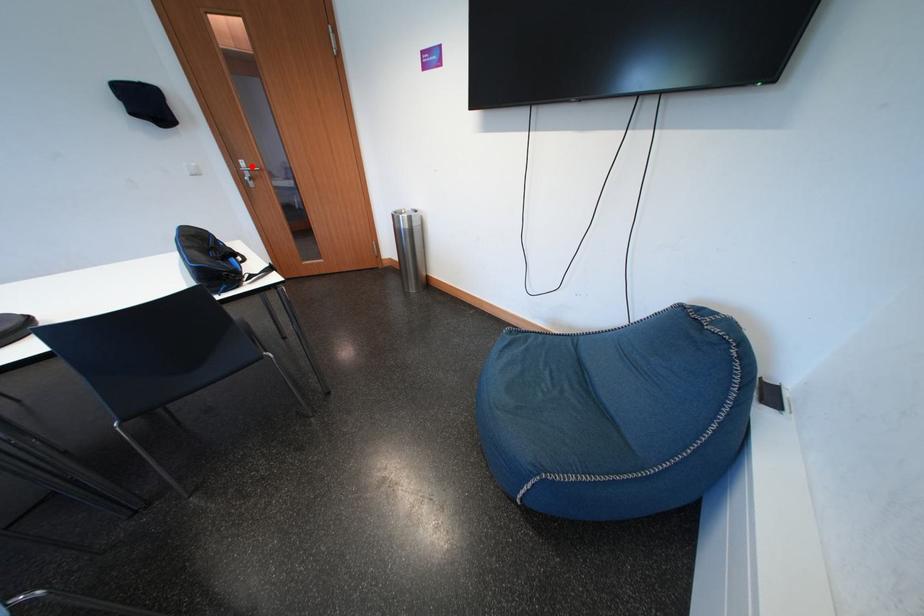
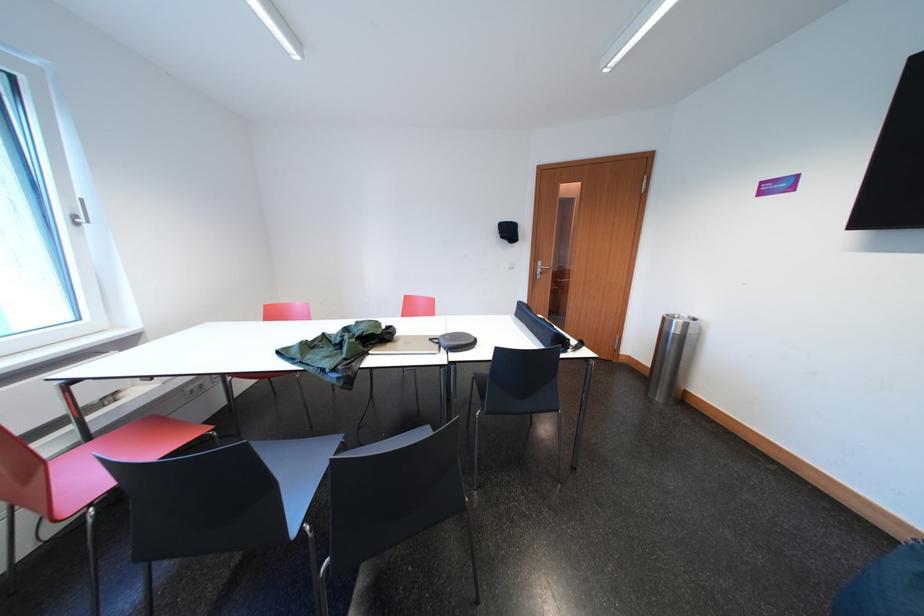
The point at the highlighted location is marked in the first image. Where is the corresponding point in the second image?

(550, 268)